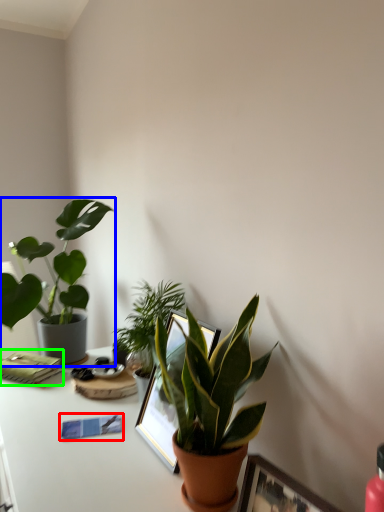
Question: Which object is positioned closest to journal (highlighted by a red box)? Select from houseplant (highlighted by a blue box) and paperback book (highlighted by a green box).

Choices:
 (A) houseplant
 (B) paperback book

Answer: (B)